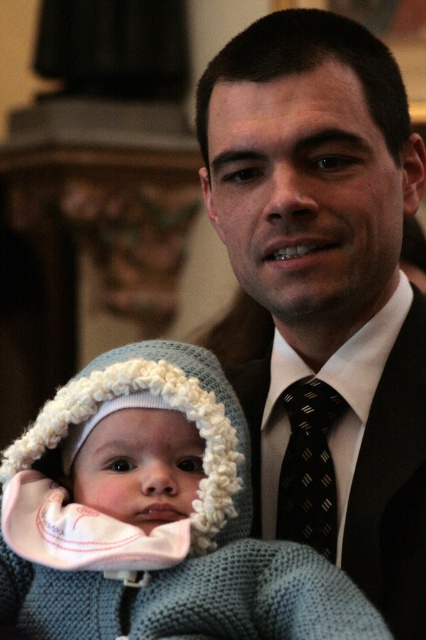
You are a photographer adjusting the lighting for a photo shoot. You need to ensure that the knitted blue hat at center and the black dotted tie at center are both well lit. Based on their positions, which object should you adjust the light to focus on first to ensure proper exposure?

The knitted blue hat at center is located below black dotted tie at center. Since the hat is lower, you should adjust the light to focus on the black dotted tie at center first as it is higher and might be in a different light zone.